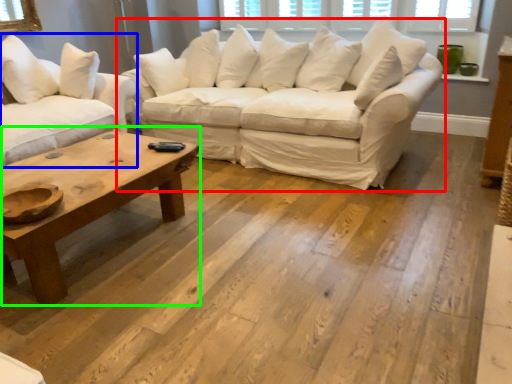
Question: Based on their relative distances, which object is farther from studio couch (highlighted by a red box)? Choose from studio couch (highlighted by a blue box) and coffee table (highlighted by a green box).

Choices:
 (A) studio couch
 (B) coffee table

Answer: (B)